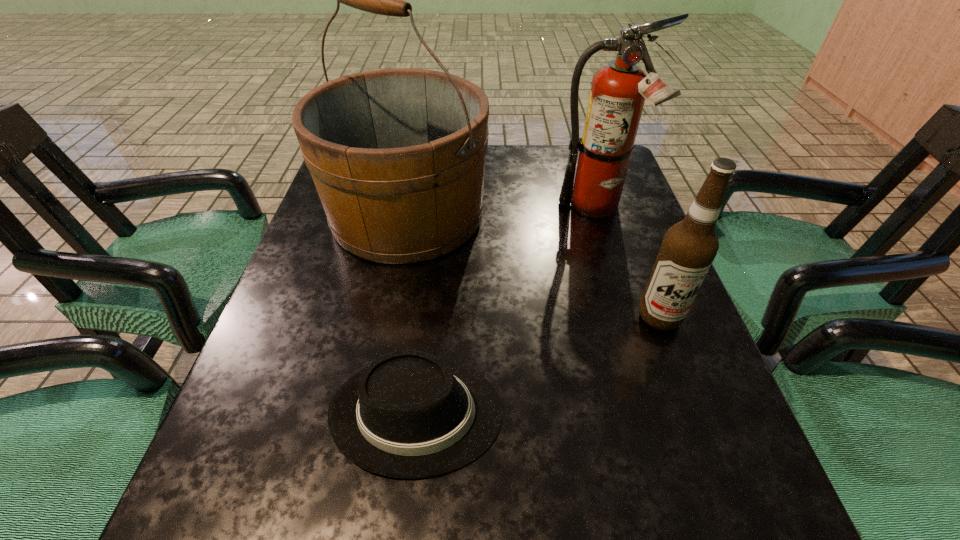
Locate an element on the screen. vacant space at the right edge is located at coordinates (664, 379).

At what (x,y) coordinates should I click in order to perform the action: click on vacant space at the far right corner of the desktop. Please return your answer as a coordinate pair (x, y). The height and width of the screenshot is (540, 960). Looking at the image, I should click on (564, 151).

Find the location of `vacant space at the near right corner`. vacant space at the near right corner is located at coordinates (663, 500).

Where is `blank region between the nearest object and the fire extinguisher`? The image size is (960, 540). blank region between the nearest object and the fire extinguisher is located at coordinates (507, 310).

The image size is (960, 540). I want to click on vacant area between the fedora and the fire extinguisher, so click(x=507, y=310).

What are the coordinates of `free space between the fire extinguisher and the bucket` in the screenshot? It's located at (501, 211).

In order to click on vacant area that lies between the third farthest object and the fire extinguisher in this screenshot , I will do `click(627, 262)`.

The height and width of the screenshot is (540, 960). What are the coordinates of `free space between the bucket and the fire extinguisher` in the screenshot? It's located at (501, 211).

The image size is (960, 540). What are the coordinates of `vacant region between the bucket and the fire extinguisher` in the screenshot? It's located at (501, 211).

Find the location of a particular element. The height and width of the screenshot is (540, 960). free space between the fire extinguisher and the nearest object is located at coordinates (507, 310).